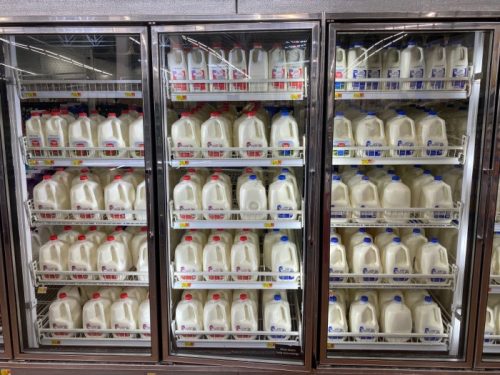
Identify the location of doors. Image resolution: width=500 pixels, height=375 pixels. (97, 351), (238, 356), (393, 357), (484, 365).